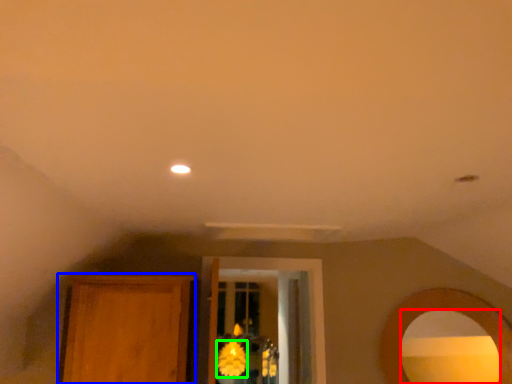
Question: Which object is the farthest from mirror (highlighted by a red box)? Choose among these: armoire (highlighted by a blue box) or flower (highlighted by a green box).

Choices:
 (A) armoire
 (B) flower

Answer: (B)